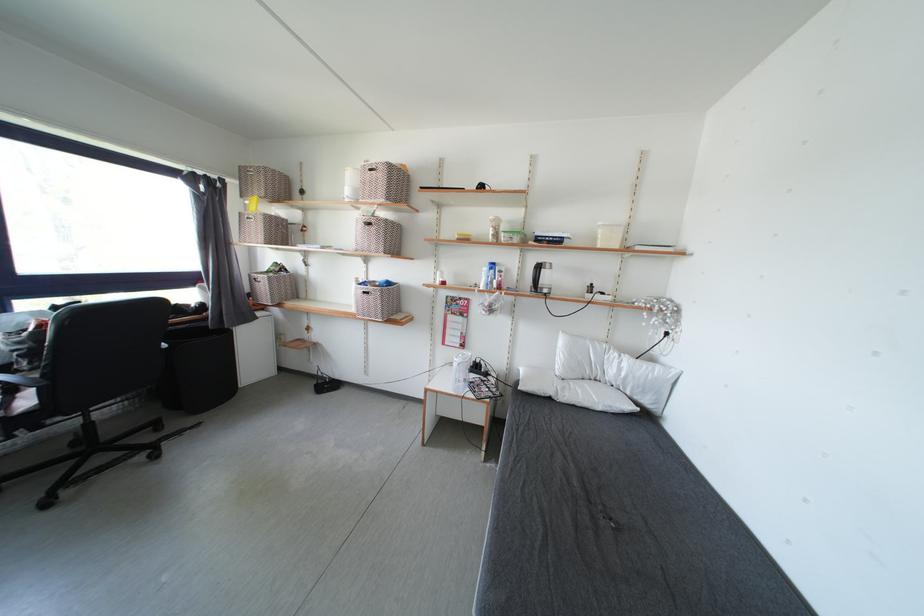
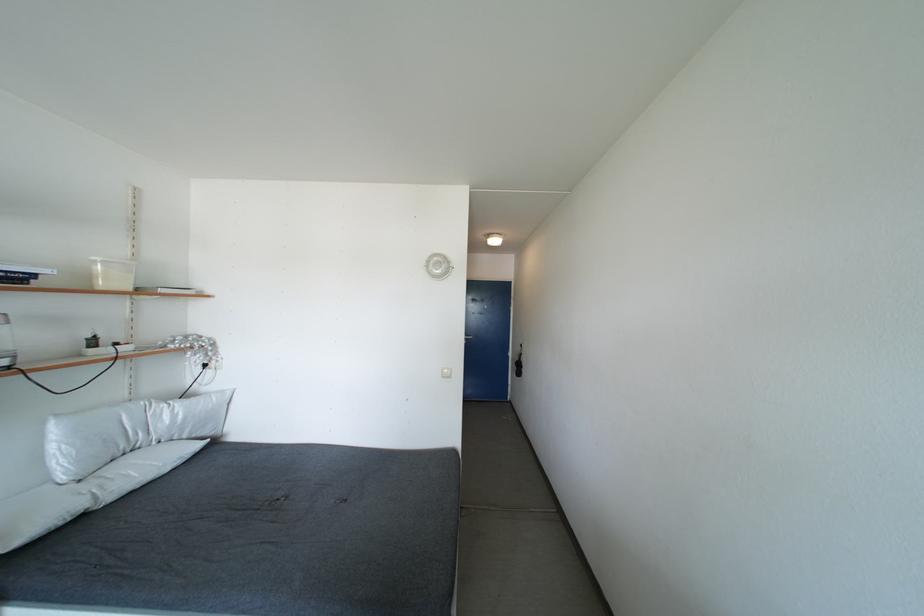
Question: The camera is either moving clockwise (left) or counter-clockwise (right) around the object. The first image is from the beginning of the video and the second image is from the end. Is the camera moving left or right when shooting the video?

Choices:
 (A) Left
 (B) Right

Answer: (A)